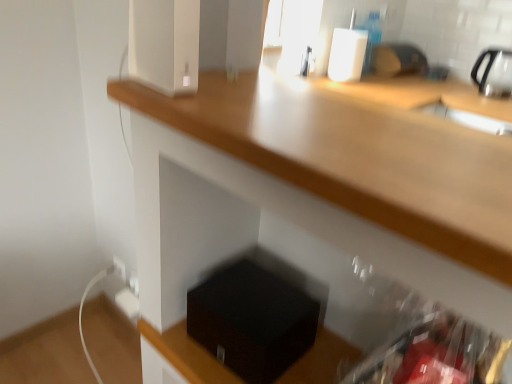
This screenshot has height=384, width=512. Describe the element at coordinates (253, 319) in the screenshot. I see `black matte box at lower center` at that location.

You are a GUI agent. You are given a task and a screenshot of the screen. Output one action in this format:
    pyautogui.click(x=<x>, y=<y>)
    Task: Click on the black matte box at lower center
    The image size is (512, 384).
    Given the screenshot: What is the action you would take?
    pyautogui.click(x=253, y=319)

In order to face white glossy speaker at upper center, should I rotate leftwards or rightwards?

You should rotate left by 12.515 degrees.

I want to click on white glossy speaker at upper center, so [164, 44].

The width and height of the screenshot is (512, 384). What do you see at coordinates (164, 44) in the screenshot?
I see `white glossy speaker at upper center` at bounding box center [164, 44].

Based on the photo, measure the distance between white glossy speaker at upper center and camera.

white glossy speaker at upper center and camera are 25.91 inches apart from each other.

I want to click on black matte box at lower center, so click(253, 319).

Does black matte box at lower center appear on the left side of white glossy speaker at upper center?

In fact, black matte box at lower center is to the right of white glossy speaker at upper center.

Between black matte box at lower center and white glossy speaker at upper center, which one is positioned in front?

white glossy speaker at upper center is more forward.

Considering the points (207, 325) and (166, 63), which point is in front, point (207, 325) or point (166, 63)?

The point (166, 63) is closer to the camera.

From the image's perspective, which one is positioned higher, black matte box at lower center or white glossy speaker at upper center?

white glossy speaker at upper center appears higher in the image.

From a real-world perspective, is black matte box at lower center on white glossy speaker at upper center?

Actually, black matte box at lower center is physically below white glossy speaker at upper center in the real world.

Is black matte box at lower center thinner than white glossy speaker at upper center?

No, black matte box at lower center is not thinner than white glossy speaker at upper center.

Who is taller, black matte box at lower center or white glossy speaker at upper center?

white glossy speaker at upper center.

Is black matte box at lower center bigger or smaller than white glossy speaker at upper center?

Considering their sizes, black matte box at lower center takes up more space than white glossy speaker at upper center.

Is white glossy speaker at upper center inside black matte box at lower center?

No, white glossy speaker at upper center is not inside black matte box at lower center.

From the picture: Is black matte box at lower center touching white glossy speaker at upper center?

black matte box at lower center is not next to white glossy speaker at upper center, and they're not touching.

Is white glossy speaker at upper center at the back of black matte box at lower center?

No, black matte box at lower center's orientation is not away from white glossy speaker at upper center.

Locate an element on the screen. Image resolution: width=512 pixels, height=384 pixels. appliance above the black matte box at lower center (from a real-world perspective) is located at coordinates (164, 44).

Considering the positions of objects white glossy speaker at upper center and black matte box at lower center in the image provided, who is more to the left, white glossy speaker at upper center or black matte box at lower center?

white glossy speaker at upper center.

Is white glossy speaker at upper center positioned before black matte box at lower center?

Yes, the depth of white glossy speaker at upper center is less than that of black matte box at lower center.

Considering the points (195, 59) and (294, 295), which point is in front, point (195, 59) or point (294, 295)?

The point (195, 59) is closer to the camera.

From the image's perspective, is white glossy speaker at upper center over black matte box at lower center?

Yes, from the image's perspective, white glossy speaker at upper center is above black matte box at lower center.

From a real-world perspective, is white glossy speaker at upper center physically above black matte box at lower center?

Yes.

Which of these two, white glossy speaker at upper center or black matte box at lower center, is wider?

black matte box at lower center is wider.

Who is shorter, white glossy speaker at upper center or black matte box at lower center?

Standing shorter between the two is black matte box at lower center.

Is white glossy speaker at upper center bigger or smaller than black matte box at lower center?

Clearly, white glossy speaker at upper center is smaller in size than black matte box at lower center.

Would you say white glossy speaker at upper center contains black matte box at lower center?

No, black matte box at lower center is not surrounded by white glossy speaker at upper center.

Is white glossy speaker at upper center next to black matte box at lower center?

No, white glossy speaker at upper center is not making contact with black matte box at lower center.

Could you tell me if white glossy speaker at upper center is facing black matte box at lower center?

No, white glossy speaker at upper center is not oriented towards black matte box at lower center.

How many degrees apart are the facing directions of white glossy speaker at upper center and black matte box at lower center?

The angular difference between white glossy speaker at upper center and black matte box at lower center is 5.63 degrees.

Locate an element on the screen. The height and width of the screenshot is (384, 512). box below the white glossy speaker at upper center (from the image's perspective) is located at coordinates (253, 319).

Locate an element on the screen. This screenshot has height=384, width=512. appliance located in front of the black matte box at lower center is located at coordinates (164, 44).

The height and width of the screenshot is (384, 512). In order to click on box that is behind the white glossy speaker at upper center in this screenshot , I will do `click(253, 319)`.